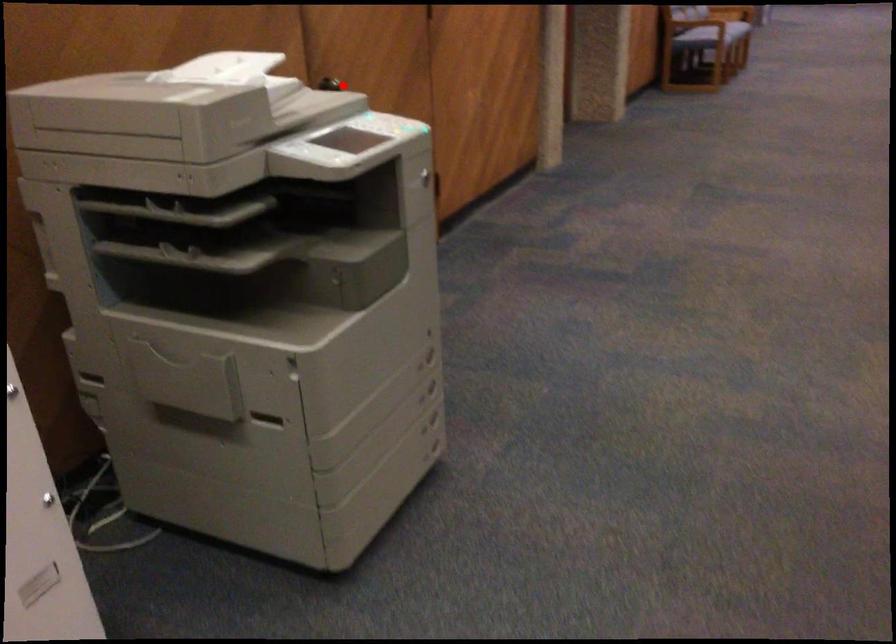
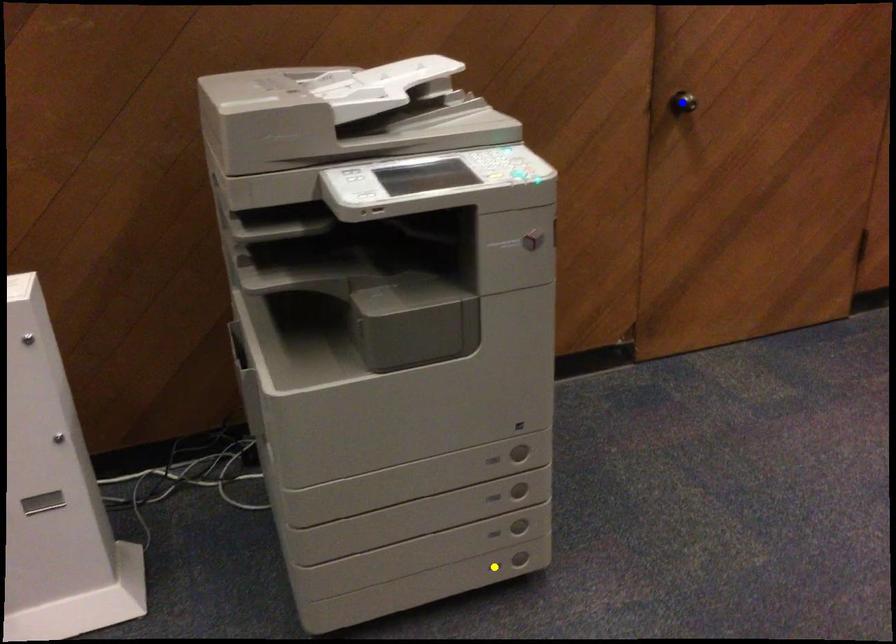
Question: I am providing you with two images of the same scene from different viewpoints. A red point is marked on the first image. You are given multiple points on the second image. Can you choose the point in image 2 that corresponds to the point in image 1?

Choices:
 (A) green point
 (B) blue point
 (C) yellow point

Answer: (B)